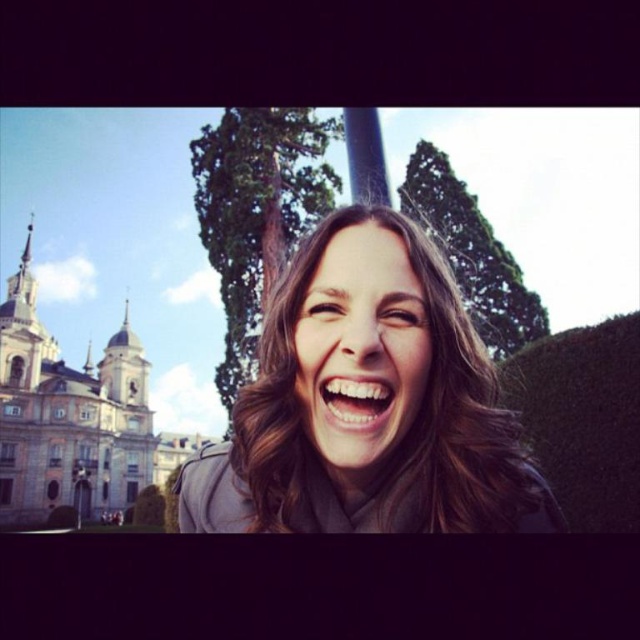
Is point (364, 332) more distant than point (371, 428)?

Yes, it is.

Between brown matte hair at center and white glossy teeth at center, which one has less height?

Standing shorter between the two is white glossy teeth at center.

In order to click on brown matte hair at center in this screenshot , I will do `click(392, 406)`.

Who is shorter, matte brown hair at center or white glossy teeth at center?

With less height is white glossy teeth at center.

Does matte brown hair at center appear under white glossy teeth at center?

No.

Is point (368, 419) positioned after point (353, 416)?

That is False.

Find the location of `matte brown hair at center`. matte brown hair at center is located at coordinates (360, 349).

Is the position of brown matte hair at center more distant than that of matte brown hair at center?

No, brown matte hair at center is closer to the viewer.

Locate an element on the screen. The image size is (640, 640). brown matte hair at center is located at coordinates (392, 406).